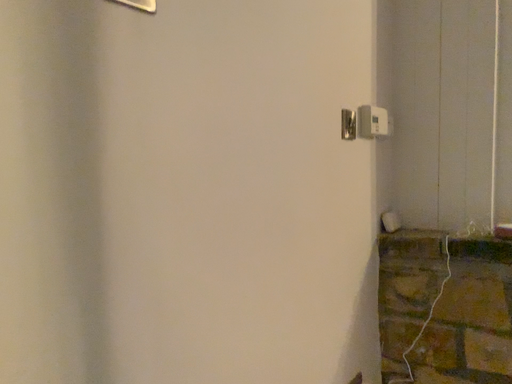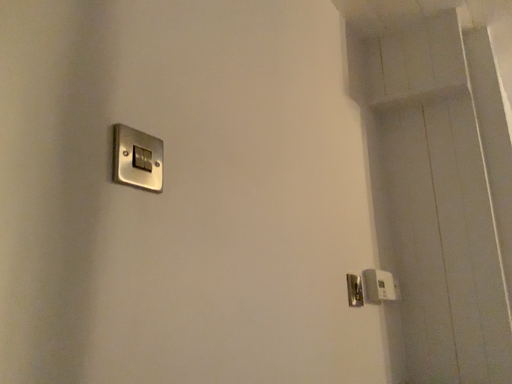
Question: Which way did the camera rotate in the video?

Choices:
 (A) rotated upward
 (B) rotated downward

Answer: (A)